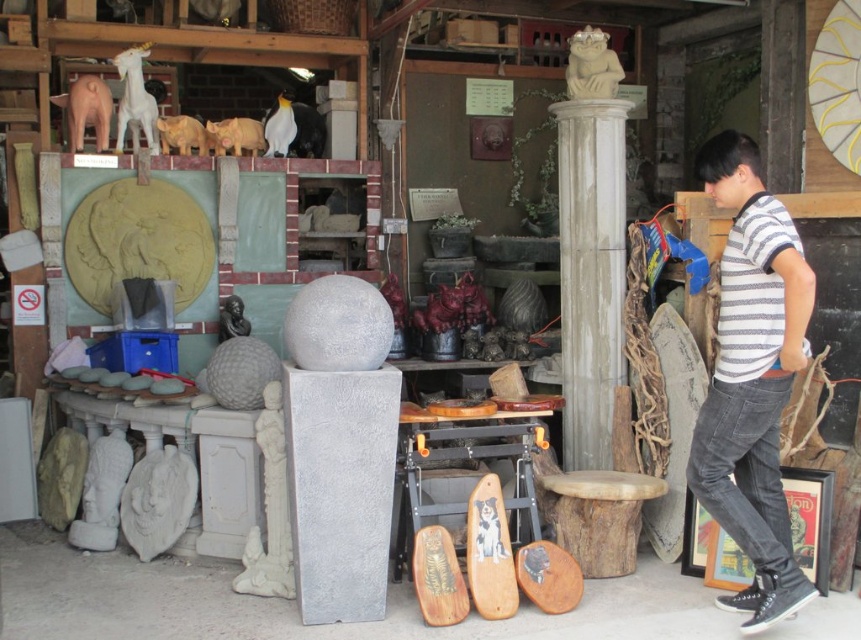
Question: Is white marble column at center bigger than wooden stool at center?

Choices:
 (A) no
 (B) yes

Answer: (B)

Question: Does white stone shield at lower left appear on the right side of matte yellow statue at upper left?

Choices:
 (A) no
 (B) yes

Answer: (B)

Question: Which point is closer to the camera?

Choices:
 (A) matte yellow statue at upper left
 (B) striped cotton shirt at right
 (C) sandy beige stone statue at upper center

Answer: (B)

Question: Among these objects, which one is farthest from the camera?

Choices:
 (A) matte pink pig at upper left
 (B) white marble column at center

Answer: (A)

Question: Which object appears farthest from the camera in this image?

Choices:
 (A) sandy beige stone statue at upper center
 (B) wooden stool at center
 (C) yellow matte hippo at upper center
 (D) white glossy unicorn at upper left

Answer: (C)

Question: Can you confirm if wooden stool at center is positioned to the right of white stone shield at lower left?

Choices:
 (A) no
 (B) yes

Answer: (B)